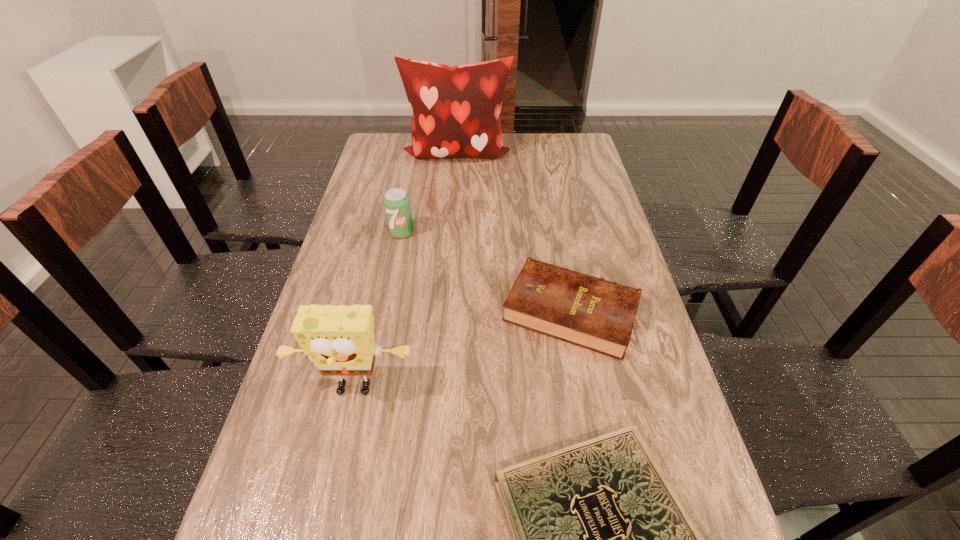
Locate an element on the screen. Image resolution: width=960 pixels, height=540 pixels. vacant space at the far right corner of the desktop is located at coordinates (551, 138).

At what (x,y) coordinates should I click in order to perform the action: click on free space between the fourth farthest object and the taller hardback book. Please return your answer as a coordinate pair (x, y). Image resolution: width=960 pixels, height=540 pixels. Looking at the image, I should click on (463, 352).

What are the coordinates of `free space between the fourth tallest object and the sponge` in the screenshot? It's located at (463, 352).

Locate an element on the screen. Image resolution: width=960 pixels, height=540 pixels. vacant space in between the farther hardback book and the second tallest object is located at coordinates (463, 352).

Where is `vacant space that is in between the tallest object and the soda`? vacant space that is in between the tallest object and the soda is located at coordinates (429, 193).

Where is `free space between the tallest object and the fourth farthest object`? This screenshot has height=540, width=960. free space between the tallest object and the fourth farthest object is located at coordinates (405, 272).

The width and height of the screenshot is (960, 540). I want to click on vacant space that's between the taller hardback book and the third shortest object, so click(x=487, y=272).

Select which object is the second closest to the cushion. Please provide its 2D coordinates. Your answer should be formatted as a tuple, i.e. [(x, y)], where the tuple contains the x and y coordinates of a point satisfying the conditions above.

[(590, 312)]

Identify the location of the third closest object to the cushion. (339, 340).

Identify the location of vacant space that satisfies the following two spatial constraints: 1. on the front-facing side of the farther hardback book; 2. on the right side of the cushion. The width and height of the screenshot is (960, 540). (444, 311).